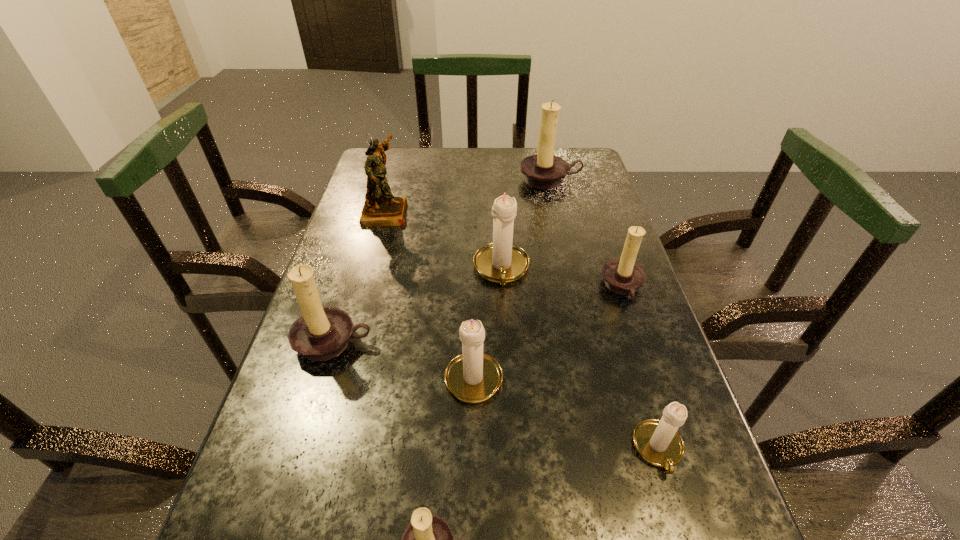
Where is `free space located on the handle side of the second biggest white candle holder`? This screenshot has width=960, height=540. free space located on the handle side of the second biggest white candle holder is located at coordinates (474, 298).

At what (x,y) coordinates should I click in order to perform the action: click on vacant space situated 0.070m on the handle side of the seventh farthest object. Please return your answer as a coordinate pair (x, y). The width and height of the screenshot is (960, 540). Looking at the image, I should click on (682, 528).

This screenshot has height=540, width=960. Find the location of `object that is at the far edge`. object that is at the far edge is located at coordinates (542, 171).

This screenshot has width=960, height=540. Identify the location of figurine present at the left edge. (381, 208).

At what (x,y) coordinates should I click in order to perform the action: click on candle holder situated at the left edge. Please return your answer as a coordinate pair (x, y). The image size is (960, 540). Looking at the image, I should click on (321, 333).

Where is `object located at the far right corner`? This screenshot has width=960, height=540. object located at the far right corner is located at coordinates (542, 171).

In the image, there is a desktop. Where is `vacant space at the right edge`? This screenshot has width=960, height=540. vacant space at the right edge is located at coordinates (597, 231).

Where is `vacant space at the far left corner`? The height and width of the screenshot is (540, 960). vacant space at the far left corner is located at coordinates (407, 152).

At what (x,y) coordinates should I click in order to perform the action: click on free location at the far right corner of the desktop. Please return your answer as a coordinate pair (x, y). Image resolution: width=960 pixels, height=540 pixels. Looking at the image, I should click on (581, 179).

The image size is (960, 540). What are the coordinates of `free area in between the rightmost white candle holder and the farthest candle holder` in the screenshot? It's located at tap(604, 315).